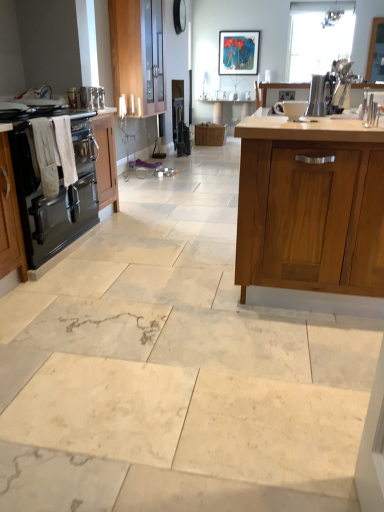
Identify the location of satin silver toaster at upper right, the 3th appliance from the left. (317, 95).

Measure the distance between point (95, 105) and camera.

Point (95, 105) and camera are 3.38 meters apart.

The width and height of the screenshot is (384, 512). What do you see at coordinates (92, 97) in the screenshot?
I see `metallic silver kettle at upper left, the 3th appliance viewed from the front` at bounding box center [92, 97].

This screenshot has width=384, height=512. What do you see at coordinates (291, 109) in the screenshot? I see `white glossy bowl at upper center, placed as the 4th appliance when sorted from top to bottom` at bounding box center [291, 109].

Describe the element at coordinates (310, 207) in the screenshot. I see `wooden cabinet at center, the 3th cabinetry when ordered from left to right` at that location.

The height and width of the screenshot is (512, 384). What do you see at coordinates (54, 153) in the screenshot?
I see `white cotton towel at left` at bounding box center [54, 153].

Where is `satin silver toaster at upper right, which ranks as the second appliance in right-to-left order`? Image resolution: width=384 pixels, height=512 pixels. satin silver toaster at upper right, which ranks as the second appliance in right-to-left order is located at coordinates (317, 95).

Does metallic silver kettle at upper left, the 3th appliance viewed from the front, have a lesser height compared to wooden table at center?

Yes, metallic silver kettle at upper left, the 3th appliance viewed from the front, is shorter than wooden table at center.

Does metallic silver kettle at upper left, the 3th appliance viewed from the front, have a lesser width compared to wooden table at center?

Indeed, metallic silver kettle at upper left, the 3th appliance viewed from the front, has a lesser width compared to wooden table at center.

Considering the relative sizes of metallic silver kettle at upper left, the third appliance in the bottom-to-top sequence, and wooden table at center in the image provided, is metallic silver kettle at upper left, the third appliance in the bottom-to-top sequence, smaller than wooden table at center?

Correct, metallic silver kettle at upper left, the third appliance in the bottom-to-top sequence, occupies less space than wooden table at center.

Is metallic silver kettle at upper left, arranged as the second appliance when viewed from the top, beside wooden table at center?

They are not placed beside each other.

Is clear glass window screen at upper right aimed at wooden cabinet at upper left, which is counted as the 2th cabinetry, starting from the left?

No, clear glass window screen at upper right is not facing towards wooden cabinet at upper left, which is counted as the 2th cabinetry, starting from the left.

Can you confirm if clear glass window screen at upper right is wider than wooden cabinet at upper left, which is counted as the 2th cabinetry, starting from the left?

No, clear glass window screen at upper right is not wider than wooden cabinet at upper left, which is counted as the 2th cabinetry, starting from the left.

Does clear glass window screen at upper right come behind wooden cabinet at upper left, which is counted as the 2th cabinetry, starting from the left?

Yes, clear glass window screen at upper right is further from the viewer.

From a real-world perspective, is clear glass window screen at upper right positioned over wooden cabinet at upper left, the second cabinetry when ordered from right to left, based on gravity?

Yes.

You are a GUI agent. You are given a task and a screenshot of the screen. Output one action in this format:
    pyautogui.click(x=<x>, y=<y>)
    Task: Click on the picture frame above the wooden cabinet at center, the 3th cabinetry when ordered from left to right (from a real-world perspective)
    Image resolution: width=384 pixels, height=512 pixels.
    Given the screenshot: What is the action you would take?
    [238, 52]

Would you consider wooden cabinet at center, the 1th cabinetry when ordered from right to left, to be distant from matte plastic picture frame at upper center?

Yes, wooden cabinet at center, the 1th cabinetry when ordered from right to left, and matte plastic picture frame at upper center are located far from each other.

Which object is closer to the camera taking this photo, wooden cabinet at center, the 3th cabinetry when ordered from left to right, or matte plastic picture frame at upper center?

wooden cabinet at center, the 3th cabinetry when ordered from left to right, is closer to the camera.

Considering the relative positions of black glass stove at left, the first cabinetry viewed from the left, and matte plastic picture frame at upper center in the image provided, is black glass stove at left, the first cabinetry viewed from the left, behind matte plastic picture frame at upper center?

No, it is not.

Identify the location of the 3rd cabinetry positioned below the matte plastic picture frame at upper center (from a real-world perspective). (64, 187).

Looking at this image, could you measure the distance between black glass stove at left, the first cabinetry viewed from the left, and matte plastic picture frame at upper center?

14.97 feet.

Does satin silver toaster at center, marked as the 4th appliance in a left-to-right arrangement, contain clear glass window screen at upper right?

No, clear glass window screen at upper right is located outside of satin silver toaster at center, marked as the 4th appliance in a left-to-right arrangement.

In terms of width, does satin silver toaster at center, arranged as the 4th appliance when ordered from the bottom, look wider or thinner when compared to clear glass window screen at upper right?

Considering their sizes, satin silver toaster at center, arranged as the 4th appliance when ordered from the bottom, looks slimmer than clear glass window screen at upper right.

Considering the points (287, 96) and (372, 69), which point is in front, point (287, 96) or point (372, 69)?

The point (287, 96) is closer to the camera.

From the picture: Which is closer, (x=90, y=201) or (x=317, y=105)?

Point (x=90, y=201) is positioned farther from the camera compared to point (x=317, y=105).

From the image's perspective, is black glass stove at left, the third cabinetry positioned from the right, under satin silver toaster at upper right, the 3th appliance when ordered from back to front?

Indeed, from the image's perspective, black glass stove at left, the third cabinetry positioned from the right, is shown beneath satin silver toaster at upper right, the 3th appliance when ordered from back to front.

Based on the photo, considering their positions, is black glass stove at left, the first cabinetry viewed from the left, located in front of or behind satin silver toaster at upper right, the 3th appliance from the left?

black glass stove at left, the first cabinetry viewed from the left, is in front of satin silver toaster at upper right, the 3th appliance from the left.

Is black glass stove at left, the third cabinetry positioned from the right, not inside satin silver toaster at upper right, which is the 3th appliance from top to bottom?

Absolutely, black glass stove at left, the third cabinetry positioned from the right, is external to satin silver toaster at upper right, which is the 3th appliance from top to bottom.

From a real-world perspective, which object stands above the other?

satin silver toaster at upper right, the 2th appliance in the front-to-back sequence, from a real-world perspective.

From the image's perspective, does white cotton towel at left appear higher than satin silver toaster at upper right, which is counted as the second appliance, starting from the bottom?

Incorrect, from the image's perspective, white cotton towel at left is lower than satin silver toaster at upper right, which is counted as the second appliance, starting from the bottom.

Is white cotton towel at left positioned with its back to satin silver toaster at upper right, which ranks as the second appliance in right-to-left order?

white cotton towel at left does not have its back to satin silver toaster at upper right, which ranks as the second appliance in right-to-left order.

I want to click on table behind the metallic silver kettle at upper left, arranged as the second appliance when viewed from the top, so pos(230,110).

The width and height of the screenshot is (384, 512). I want to click on window screen that is above the wooden cabinet at upper left, which is counted as the 2th cabinetry, starting from the left (from the image's perspective), so click(x=376, y=52).

Based on their spatial positions, is white glossy bowl at upper center, placed as the 4th appliance when sorted from top to bottom, or white cotton towel at left closer to clear glass window screen at upper right?

white glossy bowl at upper center, placed as the 4th appliance when sorted from top to bottom, is closer to clear glass window screen at upper right.

Based on the photo, when comparing their distances from black glass stove at left, the first cabinetry viewed from the left, does white cotton towel at left or white glossy bowl at upper center, the 1th appliance in the front-to-back sequence, seem further?

white glossy bowl at upper center, the 1th appliance in the front-to-back sequence, is further to black glass stove at left, the first cabinetry viewed from the left.

Looking at the image, which one is located further to black glass stove at left, the first cabinetry viewed from the left, metallic silver kettle at upper left, which is counted as the 4th appliance, starting from the right, or matte plastic picture frame at upper center?

Based on the image, matte plastic picture frame at upper center appears to be further to black glass stove at left, the first cabinetry viewed from the left.

Which object lies nearer to the anchor point wooden table at center, satin silver toaster at upper right, which is the 3th appliance from top to bottom, or matte plastic picture frame at upper center?

matte plastic picture frame at upper center.

Based on their spatial positions, is wooden table at center or satin silver toaster at center, arranged as the 4th appliance when ordered from the bottom, further from black glass stove at left, the first cabinetry viewed from the left?

wooden table at center lies further to black glass stove at left, the first cabinetry viewed from the left, than the other object.

Based on their spatial positions, is clear glass window screen at upper right or black glass stove at left, the first cabinetry viewed from the left, closer to matte plastic picture frame at upper center?

Based on the image, clear glass window screen at upper right appears to be nearer to matte plastic picture frame at upper center.

When comparing their distances from satin silver toaster at center, the 4th appliance positioned from the front, does wooden table at center or white cotton towel at left seem further?

The object further to satin silver toaster at center, the 4th appliance positioned from the front, is wooden table at center.

Looking at the image, which one is located further to metallic silver kettle at upper left, arranged as the second appliance when viewed from the top, matte plastic picture frame at upper center or black glass stove at left, the third cabinetry positioned from the right?

matte plastic picture frame at upper center.

You are a GUI agent. You are given a task and a screenshot of the screen. Output one action in this format:
    pyautogui.click(x=<x>, y=<y>)
    Task: Click on the cabinetry between satin silver toaster at upper right, the 3th appliance from the left, and clear glass window screen at upper right from front to back
    The image size is (384, 512).
    Given the screenshot: What is the action you would take?
    pyautogui.click(x=138, y=52)

Where is `picture frame between satin silver toaster at center, arranged as the 4th appliance when ordered from the bottom, and wooden table at center in the front-back direction`? Image resolution: width=384 pixels, height=512 pixels. picture frame between satin silver toaster at center, arranged as the 4th appliance when ordered from the bottom, and wooden table at center in the front-back direction is located at coordinates (238, 52).

Locate an element on the screen. This screenshot has width=384, height=512. picture frame between wooden table at center and clear glass window screen at upper right is located at coordinates (238, 52).

At what (x,y) coordinates should I click in order to perform the action: click on window screen positioned between wooden cabinet at upper left, the second cabinetry when ordered from right to left, and matte plastic picture frame at upper center from near to far. Please return your answer as a coordinate pair (x, y). This screenshot has width=384, height=512. Looking at the image, I should click on (376, 52).